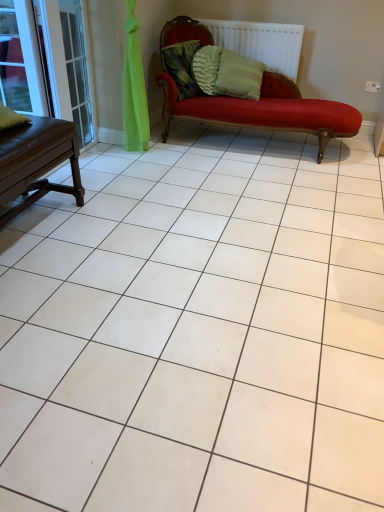
Question: Is white textured radiator at upper center spatially inside clear glass screen door at left, or outside of it?

Choices:
 (A) inside
 (B) outside

Answer: (B)

Question: From the image's perspective, relative to clear glass screen door at left, is white textured radiator at upper center above or below?

Choices:
 (A) above
 (B) below

Answer: (A)

Question: Which object is the farthest from the clear glass screen door at left?

Choices:
 (A) white textured radiator at upper center
 (B) textured green pillow at upper center, which is the 1th pillow from left to right
 (C) brown wooden table at left
 (D) clear glass window at upper left
 (E) textured green pillow at center, which appears as the 2th pillow when viewed from the left

Answer: (A)

Question: Considering the real-world distances, which object is farthest from the white textured radiator at upper center?

Choices:
 (A) textured green pillow at center, which appears as the 2th pillow when viewed from the left
 (B) textured green pillow at upper center, which is the 1th pillow from left to right
 (C) clear glass screen door at left
 (D) brown wooden table at left
 (E) clear glass window at upper left

Answer: (D)